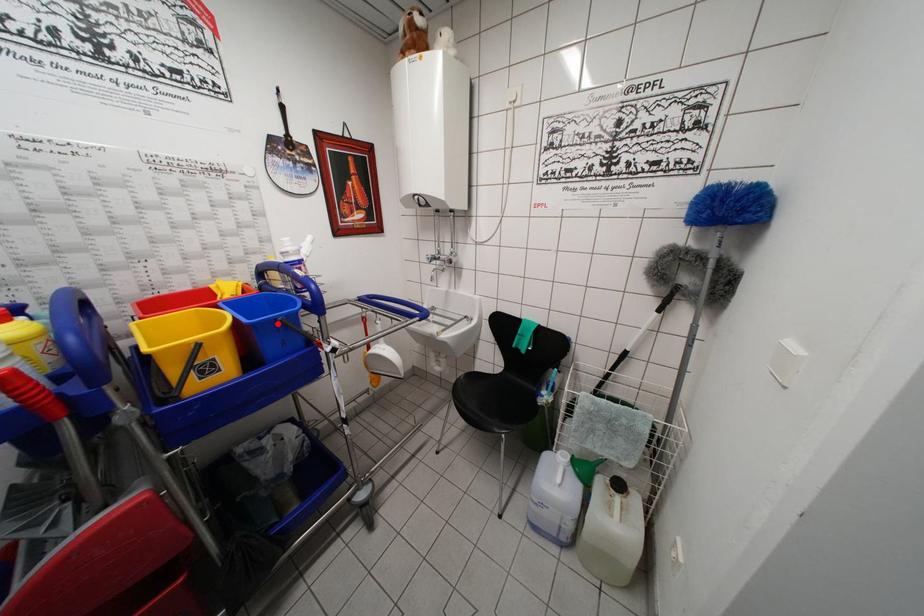
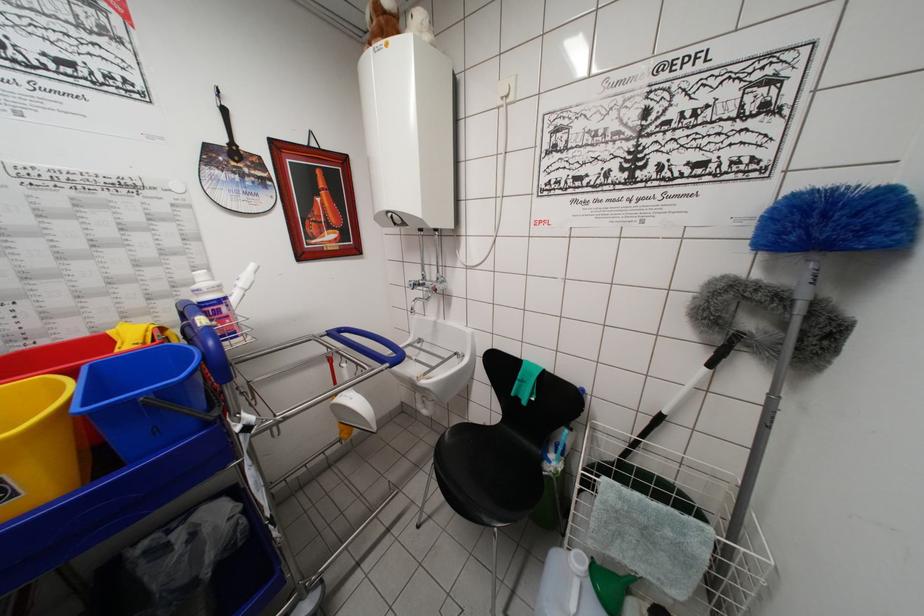
Locate, in the second image, the point that corresponds to the highlighted location in the first image.

(136, 405)